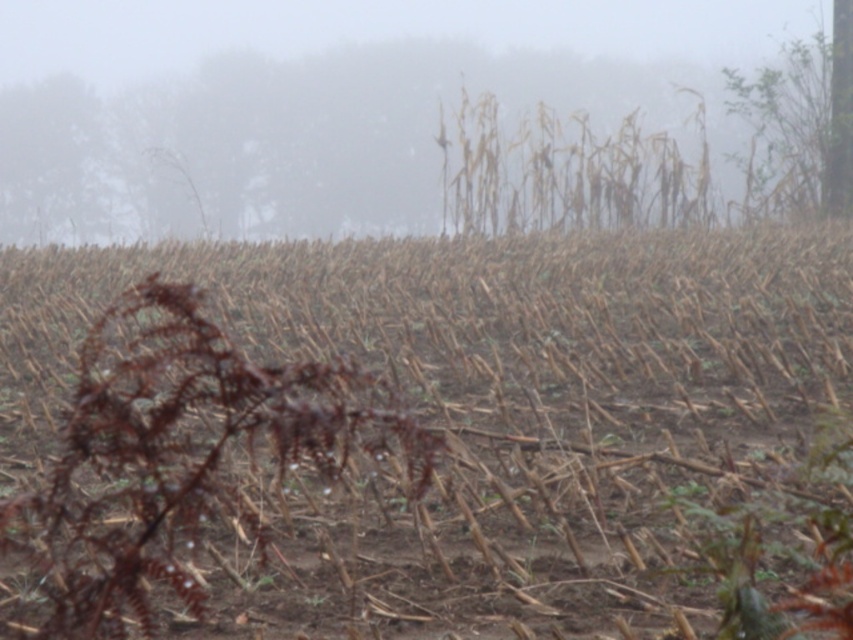
Question: Which of the following is the closest to the observer?

Choices:
 (A) foggy haze at upper center
 (B) brown dry stalks at center

Answer: (B)

Question: Can you confirm if brown dry stalks at center is positioned to the left of foggy haze at upper center?

Choices:
 (A) yes
 (B) no

Answer: (A)

Question: Can you confirm if brown dry stalks at center is thinner than foggy haze at upper center?

Choices:
 (A) yes
 (B) no

Answer: (A)

Question: Which point is farther to the camera?

Choices:
 (A) foggy haze at upper center
 (B) brown dry stalks at center

Answer: (A)

Question: Does brown dry stalks at center appear on the left side of foggy haze at upper center?

Choices:
 (A) yes
 (B) no

Answer: (A)